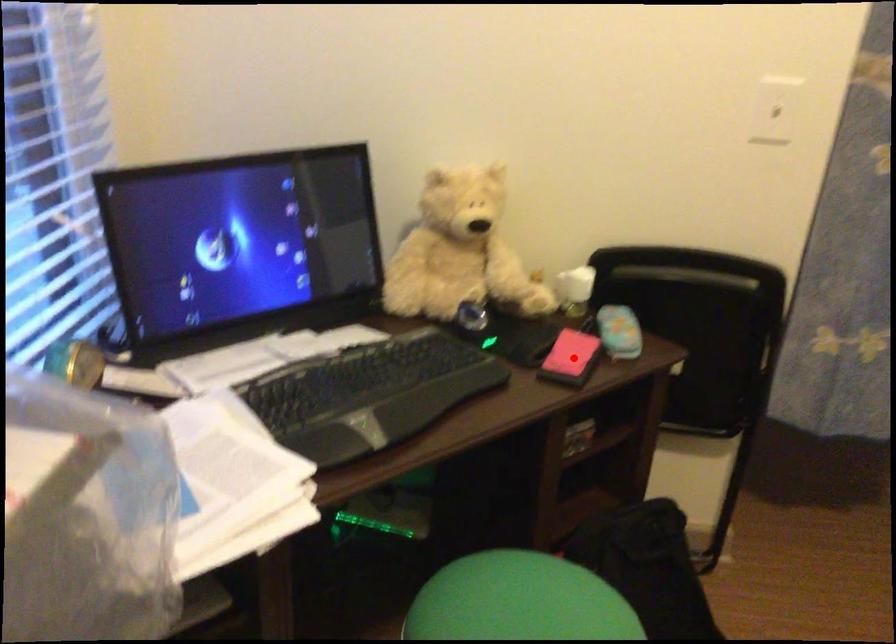
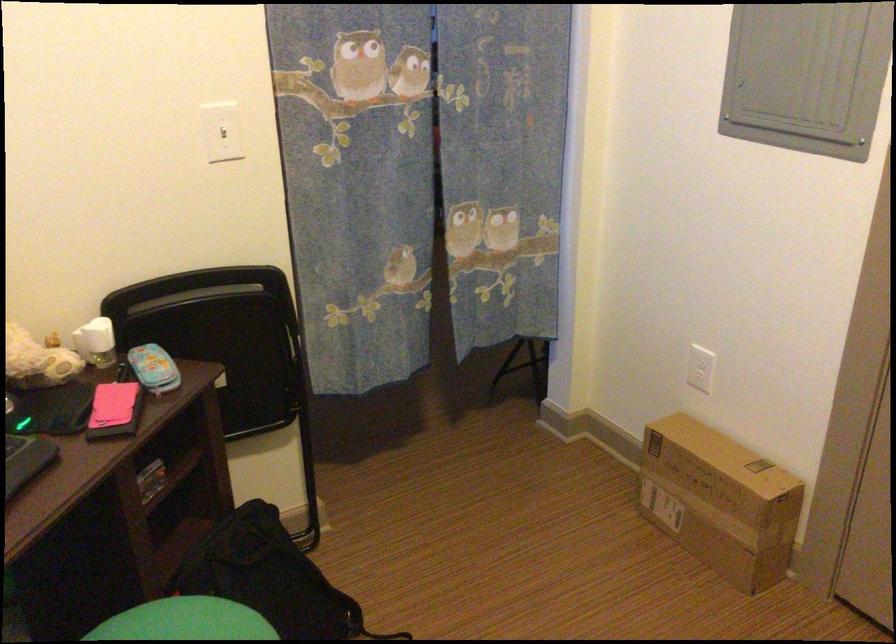
Locate, in the second image, the point that corresponds to the highlighted location in the first image.

(114, 410)